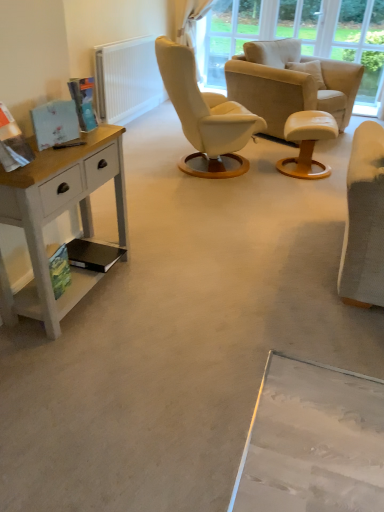
Locate an element on the screen. The width and height of the screenshot is (384, 512). vacant space in front of white leather stool at center is located at coordinates (304, 190).